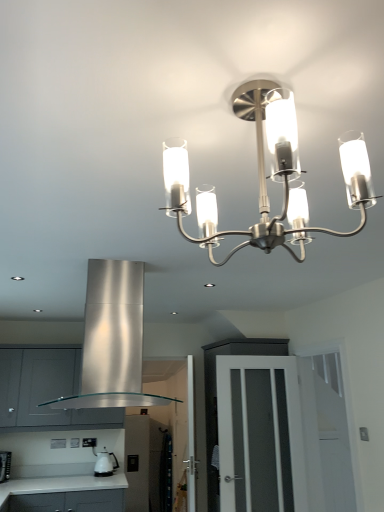
Question: From a real-world perspective, is white laminate countertop at lower left on stainless steel exhaust hood at center?

Choices:
 (A) yes
 (B) no

Answer: (B)

Question: Can you see white laminate countertop at lower left touching stainless steel exhaust hood at center?

Choices:
 (A) yes
 (B) no

Answer: (B)

Question: Is white laminate countertop at lower left closer to the viewer compared to stainless steel exhaust hood at center?

Choices:
 (A) yes
 (B) no

Answer: (B)

Question: Is white laminate countertop at lower left wider than stainless steel exhaust hood at center?

Choices:
 (A) yes
 (B) no

Answer: (A)

Question: Is white laminate countertop at lower left oriented away from stainless steel exhaust hood at center?

Choices:
 (A) no
 (B) yes

Answer: (A)

Question: Is white laminate countertop at lower left positioned beyond the bounds of stainless steel exhaust hood at center?

Choices:
 (A) yes
 (B) no

Answer: (A)

Question: Is white laminate countertop at lower left beside satin silver cabinet at lower left?

Choices:
 (A) no
 (B) yes

Answer: (A)

Question: Is white laminate countertop at lower left behind satin silver cabinet at lower left?

Choices:
 (A) yes
 (B) no

Answer: (B)

Question: Considering the relative sizes of white laminate countertop at lower left and satin silver cabinet at lower left in the image provided, is white laminate countertop at lower left thinner than satin silver cabinet at lower left?

Choices:
 (A) no
 (B) yes

Answer: (A)

Question: Does white laminate countertop at lower left have a lesser height compared to satin silver cabinet at lower left?

Choices:
 (A) no
 (B) yes

Answer: (B)

Question: Would you say white laminate countertop at lower left contains satin silver cabinet at lower left?

Choices:
 (A) no
 (B) yes

Answer: (A)

Question: From a real-world perspective, does white laminate countertop at lower left stand above satin silver cabinet at lower left?

Choices:
 (A) no
 (B) yes

Answer: (A)

Question: Considering the relative sizes of white glossy kettle at lower left and satin silver cabinet at lower left in the image provided, is white glossy kettle at lower left smaller than satin silver cabinet at lower left?

Choices:
 (A) no
 (B) yes

Answer: (B)